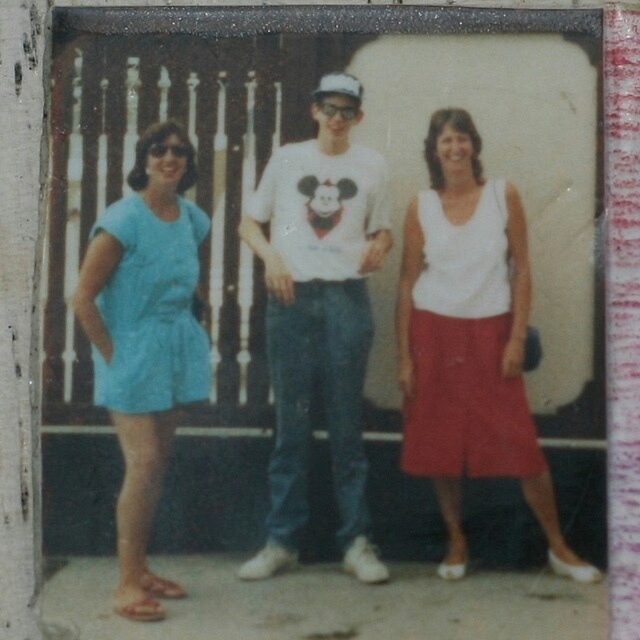
Question: Which point is closer to the camera taking this photo?

Choices:
 (A) (150, 228)
 (B) (483, 304)
 (C) (342, 476)

Answer: (C)

Question: Is white cotton t-shirt at center positioned before light blue fabric dress at left?

Choices:
 (A) yes
 (B) no

Answer: (B)

Question: Which object is farther from the camera taking this photo?

Choices:
 (A) white matte tank top at center
 (B) white cotton t-shirt at center

Answer: (B)

Question: Is white matte tank top at center further to the viewer compared to light blue fabric dress at left?

Choices:
 (A) yes
 (B) no

Answer: (A)

Question: Which object is farther from the camera taking this photo?

Choices:
 (A) white matte tank top at center
 (B) white cotton t-shirt at center
 (C) light blue fabric dress at left

Answer: (B)

Question: Is white matte tank top at center behind light blue fabric dress at left?

Choices:
 (A) no
 (B) yes

Answer: (B)